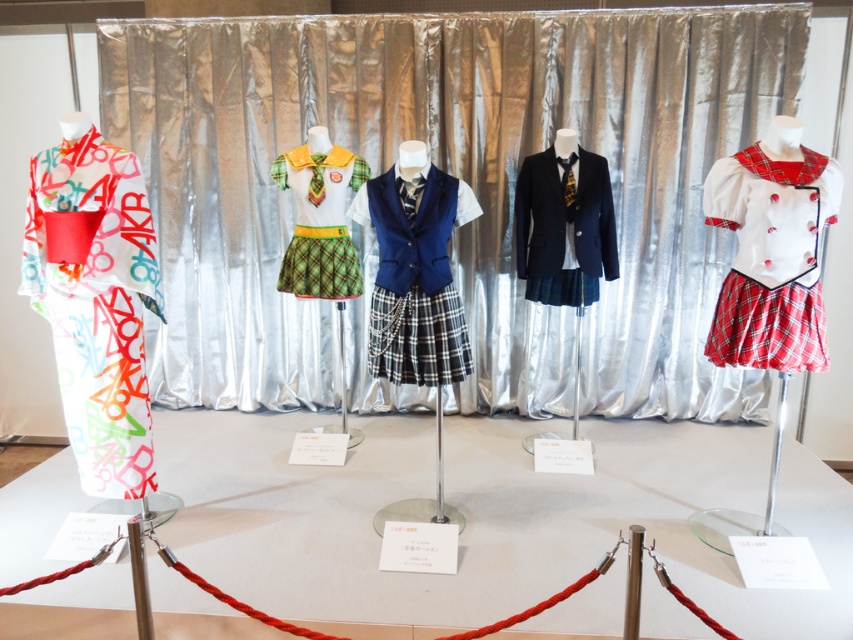
You are a fashion designer observing the display and need to adjust the height of the white plaid skirt at center and navy blue fabric blazer at center so they are the same height. Which one do you need to raise or lower?

The white plaid skirt at center is taller than the navy blue fabric blazer at center. To make them the same height, you need to lower the white plaid skirt at center or raise the navy blue fabric blazer at center.

You are standing in front of the display of five mannequins. There are two points marked in the scene, one at coordinates point (287, 58) and another at point (86, 442). Which of these points is closer to you?

Point (287, 58) is further to the camera than point (86, 442), so the point closer to you is point (86, 442).